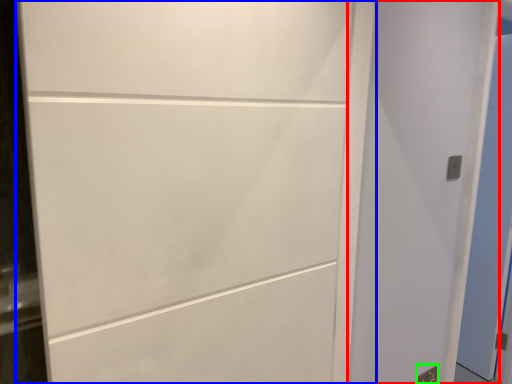
Question: Considering the real-world distances, which object is closest to door (highlighted by a red box)? door (highlighted by a blue box) or electric outlet (highlighted by a green box).

Choices:
 (A) door
 (B) electric outlet

Answer: (A)